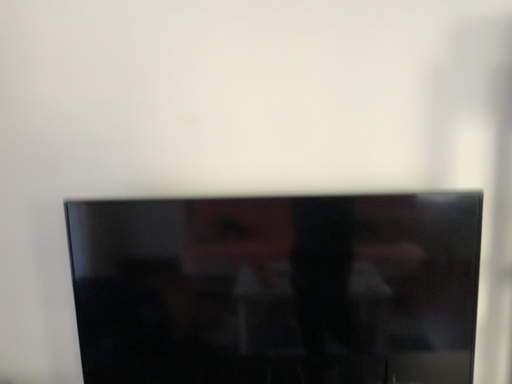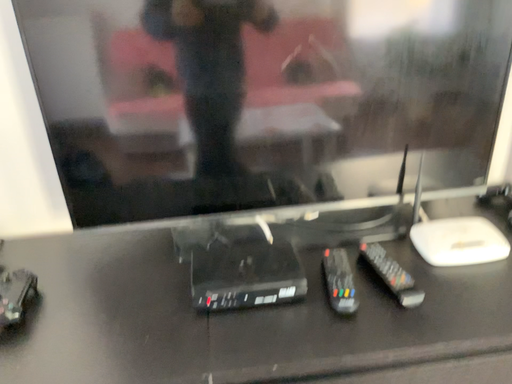
Question: How did the camera likely rotate when shooting the video?

Choices:
 (A) rotated downward
 (B) rotated upward

Answer: (A)